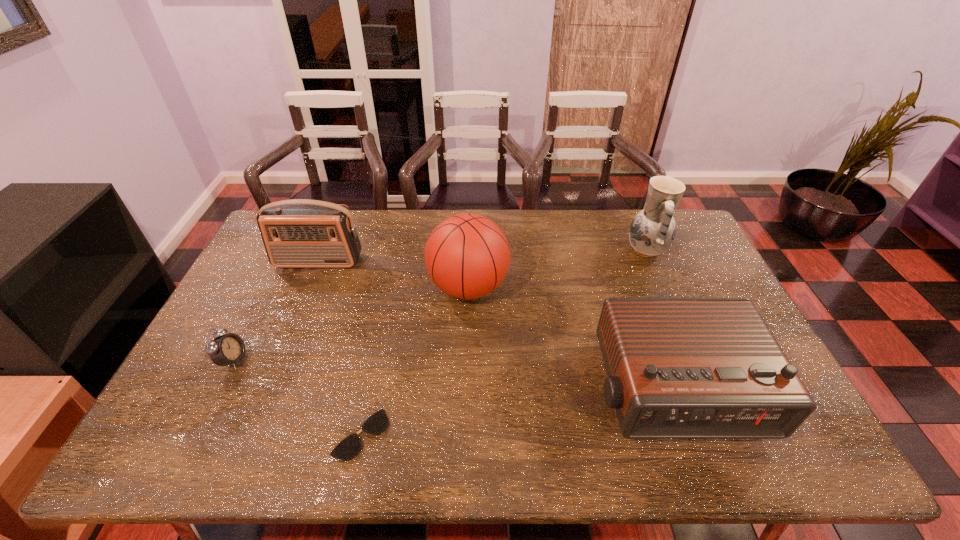
This screenshot has height=540, width=960. I want to click on unoccupied position between the left radio receiver and the alarm clock, so click(x=276, y=311).

The image size is (960, 540). I want to click on vacant area that lies between the right radio receiver and the fourth object from right to left, so click(516, 411).

At what (x,y) coordinates should I click in order to perform the action: click on vacant region between the second shortest object and the third object from left to right. Please return your answer as a coordinate pair (x, y). This screenshot has height=540, width=960. Looking at the image, I should click on (298, 397).

In order to click on free area in between the fifth tallest object and the spectacles in this screenshot , I will do `click(298, 397)`.

Where is `blank region between the second shortest object and the pottery`? The height and width of the screenshot is (540, 960). blank region between the second shortest object and the pottery is located at coordinates (440, 305).

At what (x,y) coordinates should I click in order to perform the action: click on empty location between the shorter radio receiver and the left radio receiver. Please return your answer as a coordinate pair (x, y). The image size is (960, 540). Looking at the image, I should click on (495, 325).

Find the location of a particular element. The height and width of the screenshot is (540, 960). unoccupied position between the nearer radio receiver and the farther radio receiver is located at coordinates (495, 325).

This screenshot has width=960, height=540. Identify the location of unoccupied position between the shortest object and the pottery. click(x=503, y=342).

Identify the location of the second closest object to the fourth object from left to right. The image size is (960, 540). (299, 233).

This screenshot has width=960, height=540. Find the location of `object that stands as the closest to the basketball`. object that stands as the closest to the basketball is located at coordinates (677, 367).